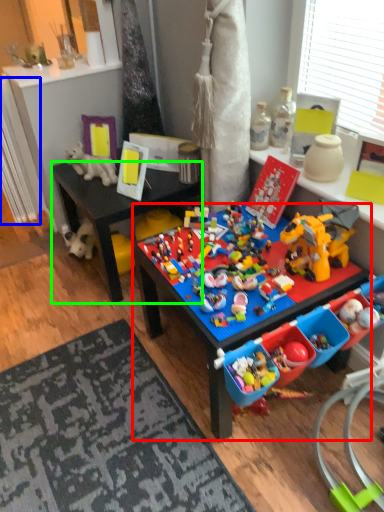
Question: Based on their relative distances, which object is farther from table (highlighted by a red box)? Choose from radiator (highlighted by a blue box) and desk (highlighted by a green box).

Choices:
 (A) radiator
 (B) desk

Answer: (A)